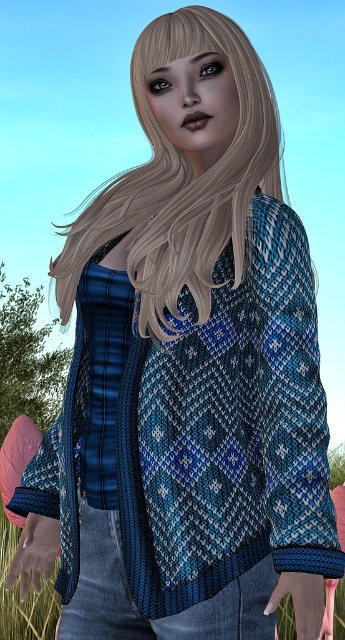
Question: Does denim at center have a lesser width compared to green grass at lower left?

Choices:
 (A) yes
 (B) no

Answer: (A)

Question: Does blondehair at center come behind denim at center?

Choices:
 (A) no
 (B) yes

Answer: (A)

Question: Which object is farther from the camera taking this photo?

Choices:
 (A) denim at center
 (B) blondehair at center
 (C) green grass at lower left

Answer: (C)

Question: Which of the following is the farthest from the observer?

Choices:
 (A) denim at center
 (B) blondehair at center

Answer: (A)

Question: Which object is closer to the camera taking this photo?

Choices:
 (A) denim at center
 (B) green grass at lower left

Answer: (A)

Question: Where is blondehair at center located in relation to denim at center in the image?

Choices:
 (A) left
 (B) right

Answer: (B)